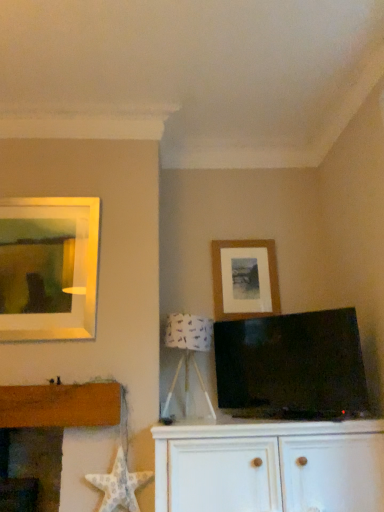
Where is `matte black tv at center`? matte black tv at center is located at coordinates (291, 366).

What is the approximate width of white fabric lampshade at center?

14.31 inches.

Image resolution: width=384 pixels, height=512 pixels. What do you see at coordinates (119, 485) in the screenshot?
I see `white textured starfish at lower left` at bounding box center [119, 485].

What is the approximate width of wooden picture frame at upper right?

1.68 inches.

Find the location of a particular element. Image resolution: width=384 pixels, height=512 pixels. white wood cabinet at center is located at coordinates (270, 466).

Where is `matte black tv at center`? Image resolution: width=384 pixels, height=512 pixels. matte black tv at center is located at coordinates (291, 366).

Can you confirm if matte black tv at center is taller than white wood cabinet at center?

Correct, matte black tv at center is much taller as white wood cabinet at center.

Is matte black tv at center in front of white wood cabinet at center?

No.

Is matte black tv at center to the right of white wood cabinet at center from the viewer's perspective?

Yes, matte black tv at center is to the right of white wood cabinet at center.

Is matte black tv at center directly adjacent to wooden picture frame at upper right?

matte black tv at center and wooden picture frame at upper right are not in contact.

From a real-world perspective, is matte black tv at center above or below wooden picture frame at upper right?

From a real-world perspective, matte black tv at center is physically below wooden picture frame at upper right.

In the scene shown: Which is closer, (302, 381) or (251, 287)?

The point (302, 381) is closer.

What's the angular difference between matte black tv at center and wooden picture frame at upper right's facing directions?

The facing directions of matte black tv at center and wooden picture frame at upper right are 39 degrees apart.

In order to click on television located behind the white wood cabinet at center in this screenshot , I will do `click(291, 366)`.

Considering the relative sizes of white wood cabinet at center and matte black tv at center in the image provided, is white wood cabinet at center bigger than matte black tv at center?

Yes, white wood cabinet at center is bigger than matte black tv at center.

Is white wood cabinet at center oriented away from matte black tv at center?

white wood cabinet at center is not turned away from matte black tv at center.

Is white wood cabinet at center in front of or behind white fabric lampshade at center in the image?

white wood cabinet at center is positioned closer to the viewer than white fabric lampshade at center.

Are white wood cabinet at center and white fabric lampshade at center located far from each other?

white wood cabinet at center is actually quite close to white fabric lampshade at center.

Considering the sizes of objects white wood cabinet at center and white fabric lampshade at center in the image provided, who is taller, white wood cabinet at center or white fabric lampshade at center?

With more height is white fabric lampshade at center.

Where is `cabinetry that appears in front of the white fabric lampshade at center`? The width and height of the screenshot is (384, 512). cabinetry that appears in front of the white fabric lampshade at center is located at coordinates (270, 466).

Considering the sizes of white textured starfish at lower left and white wood cabinet at center in the image, is white textured starfish at lower left wider or thinner than white wood cabinet at center?

Clearly, white textured starfish at lower left has less width compared to white wood cabinet at center.

From a real-world perspective, which is physically below, white textured starfish at lower left or white wood cabinet at center?

white wood cabinet at center, from a real-world perspective.

Based on their positions, is white textured starfish at lower left located to the left or right of white wood cabinet at center?

white textured starfish at lower left is positioned on white wood cabinet at center's left side.

Does white textured starfish at lower left have a greater height compared to white wood cabinet at center?

In fact, white textured starfish at lower left may be shorter than white wood cabinet at center.

Is white textured starfish at lower left located within white fabric lampshade at center?

No, white textured starfish at lower left is not surrounded by white fabric lampshade at center.

Could you tell me if white fabric lampshade at center is facing white textured starfish at lower left?

No, white fabric lampshade at center is not oriented towards white textured starfish at lower left.

Which object is closer to the camera taking this photo, white fabric lampshade at center or white textured starfish at lower left?

white textured starfish at lower left.

Can you confirm if white fabric lampshade at center is shorter than white textured starfish at lower left?

Incorrect, the height of white fabric lampshade at center does not fall short of that of white textured starfish at lower left.

Based on the photo, is white fabric lampshade at center positioned with its back to matte black tv at center?

white fabric lampshade at center does not have its back to matte black tv at center.

Does point (181, 319) come closer to viewer compared to point (290, 327)?

No, (181, 319) is behind (290, 327).

Is white fabric lampshade at center to the right of matte black tv at center from the viewer's perspective?

Incorrect, white fabric lampshade at center is not on the right side of matte black tv at center.

From the image's perspective, is white fabric lampshade at center located above matte black tv at center?

No, from the image's perspective, white fabric lampshade at center is not over matte black tv at center.

I want to click on cabinetry that appears in front of the matte black tv at center, so click(270, 466).

There is a matte black tv at center. Where is `picture frame above it (from a real-world perspective)`? This screenshot has height=512, width=384. picture frame above it (from a real-world perspective) is located at coordinates (245, 279).

Which object lies nearer to the anchor point white fabric lampshade at center, wooden picture frame at upper right or white textured starfish at lower left?

wooden picture frame at upper right lies closer to white fabric lampshade at center than the other object.

Consider the image. Which object lies nearer to the anchor point matte black tv at center, wooden picture frame at upper right or white fabric lampshade at center?

Among the two, white fabric lampshade at center is located nearer to matte black tv at center.

Looking at the image, which one is located further to white fabric lampshade at center, matte black tv at center or white wood cabinet at center?

Among the two, white wood cabinet at center is located further to white fabric lampshade at center.

Based on the photo, which object lies nearer to the anchor point matte black tv at center, wooden picture frame at upper right or white textured starfish at lower left?

The object closer to matte black tv at center is wooden picture frame at upper right.

Based on their spatial positions, is wooden picture frame at upper right or white fabric lampshade at center closer to white wood cabinet at center?

white fabric lampshade at center lies closer to white wood cabinet at center than the other object.

Looking at the image, which one is located further to matte black tv at center, wooden picture frame at upper right or white wood cabinet at center?

Among the two, wooden picture frame at upper right is located further to matte black tv at center.

When comparing their distances from white textured starfish at lower left, does white wood cabinet at center or white fabric lampshade at center seem further?

Among the two, white fabric lampshade at center is located further to white textured starfish at lower left.

Looking at the image, which one is located closer to white wood cabinet at center, white textured starfish at lower left or white fabric lampshade at center?

Among the two, white textured starfish at lower left is located nearer to white wood cabinet at center.

Where is `table lamp located between white textured starfish at lower left and matte black tv at center in the left-right direction`? The width and height of the screenshot is (384, 512). table lamp located between white textured starfish at lower left and matte black tv at center in the left-right direction is located at coordinates (187, 352).

Locate an element on the screen. The height and width of the screenshot is (512, 384). picture frame located between white textured starfish at lower left and matte black tv at center in the left-right direction is located at coordinates (245, 279).

At what (x,y) coordinates should I click in order to perform the action: click on table lamp that lies between wooden picture frame at upper right and white wood cabinet at center from top to bottom. Please return your answer as a coordinate pair (x, y). Image resolution: width=384 pixels, height=512 pixels. Looking at the image, I should click on (187, 352).

What are the coordinates of `table lamp that lies between matte black tv at center and white wood cabinet at center from top to bottom` in the screenshot? It's located at (187, 352).